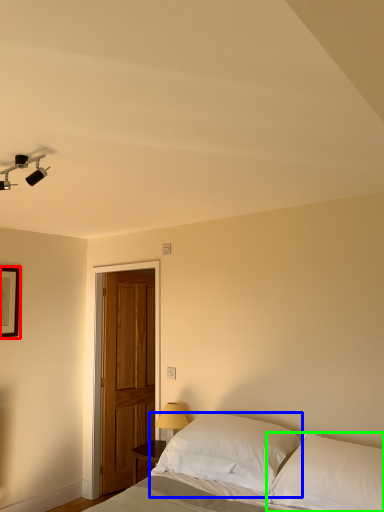
Question: Which object is positioned closest to picture frame (highlighted by a red box)? Select from pillow (highlighted by a blue box) and pillow (highlighted by a green box).

Choices:
 (A) pillow
 (B) pillow

Answer: (A)